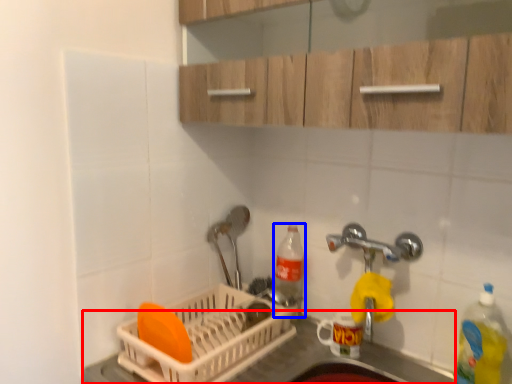
Question: Which point is closer to the camera, counter top (highlighted by a red box) or bottle (highlighted by a blue box)?

Choices:
 (A) counter top
 (B) bottle

Answer: (A)